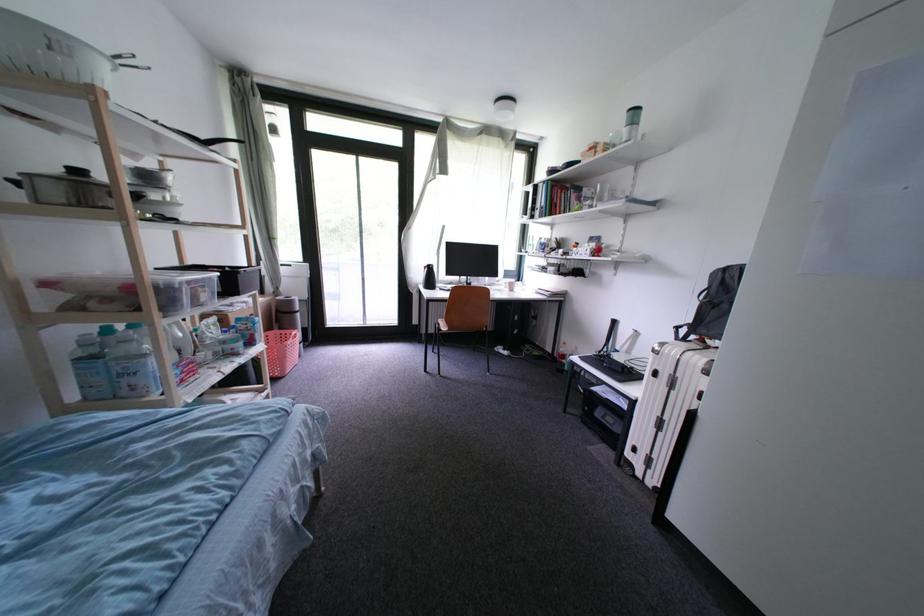
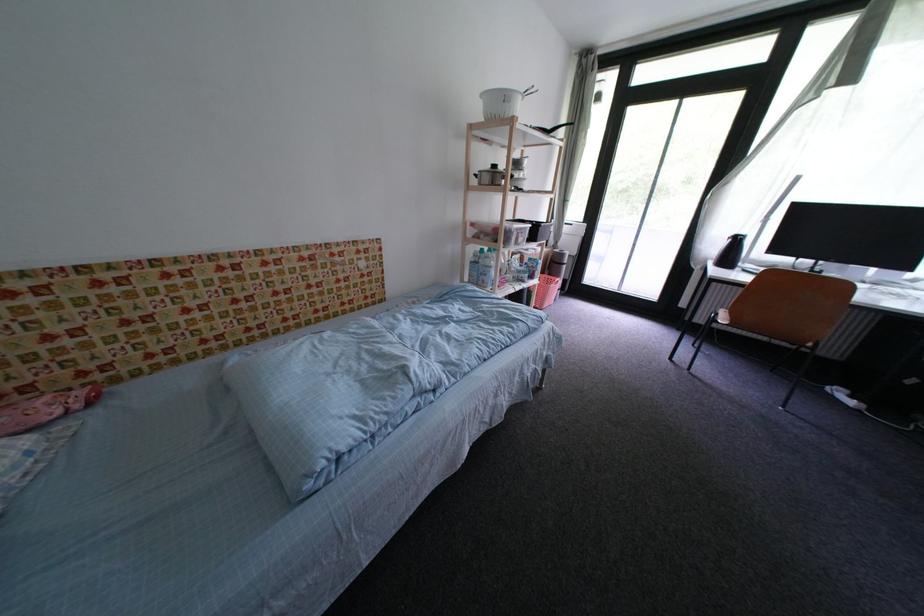
In the second image, find the point that corresponds to point 439,284 in the first image.

(736, 261)